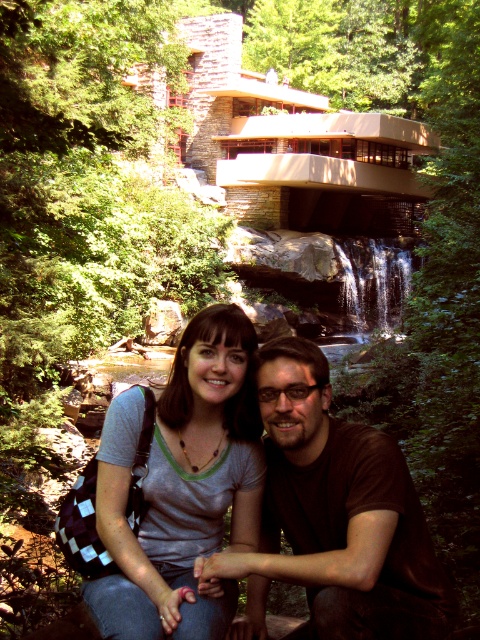
Question: From the image, what is the correct spatial relationship of brown matte shirt at center in relation to matte gray t-shirt at center?

Choices:
 (A) above
 (B) below

Answer: (B)

Question: Considering the relative positions of brown matte shirt at center and matte gray t-shirt at center in the image provided, where is brown matte shirt at center located with respect to matte gray t-shirt at center?

Choices:
 (A) below
 (B) above

Answer: (A)

Question: Does brown matte shirt at center have a lesser width compared to matte gray t-shirt at center?

Choices:
 (A) yes
 (B) no

Answer: (B)

Question: Which point appears closest to the camera in this image?

Choices:
 (A) (406, 557)
 (B) (177, 349)

Answer: (A)